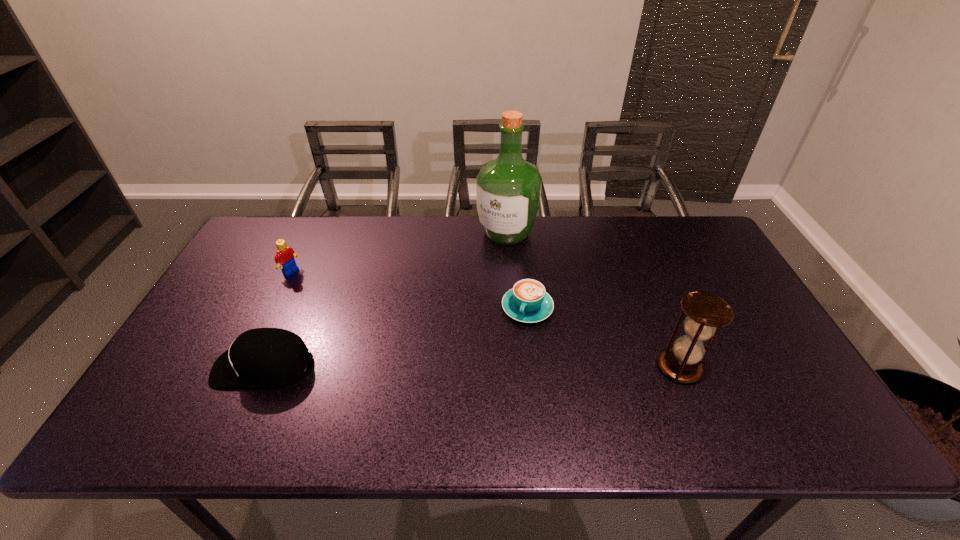
Image resolution: width=960 pixels, height=540 pixels. Find the location of `free space on the desktop that is between the cap and the second tallest object and is positioned with the handle on the right side of the shortest object`. free space on the desktop that is between the cap and the second tallest object and is positioned with the handle on the right side of the shortest object is located at coordinates (502, 367).

This screenshot has height=540, width=960. What are the coordinates of `free space on the desktop that is between the fourth tallest object and the fourth shortest object and is positioned on the front-facing side of the third tallest object` in the screenshot? It's located at (463, 367).

This screenshot has width=960, height=540. I want to click on vacant spot on the desktop that is between the fourth tallest object and the hourglass and is positioned on the front-facing side of the tallest object, so click(411, 367).